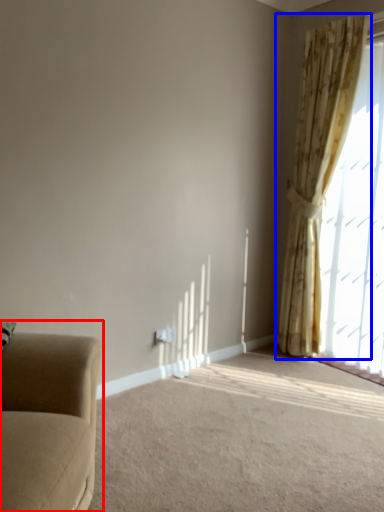
Question: Which point is closer to the camera, studio couch (highlighted by a red box) or curtain (highlighted by a blue box)?

Choices:
 (A) studio couch
 (B) curtain

Answer: (A)